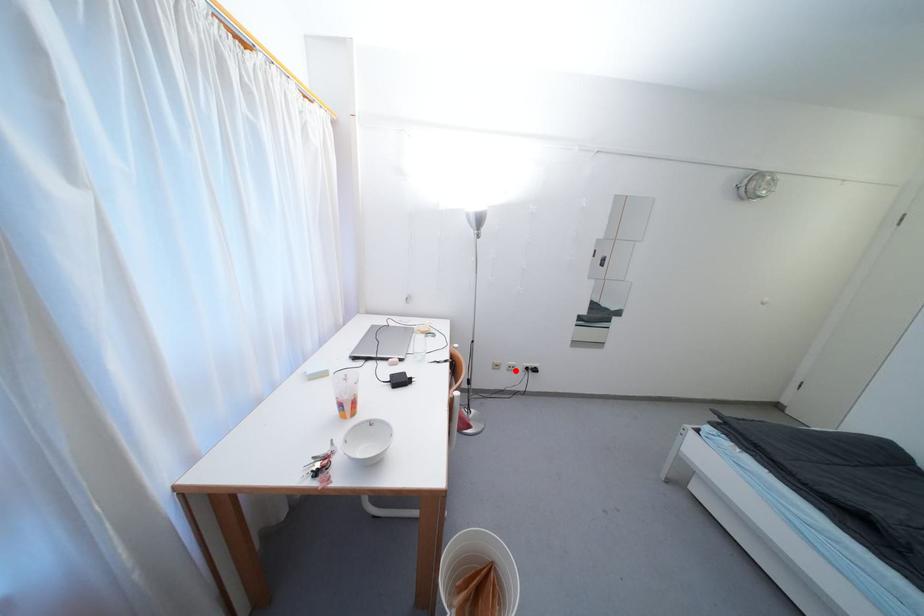
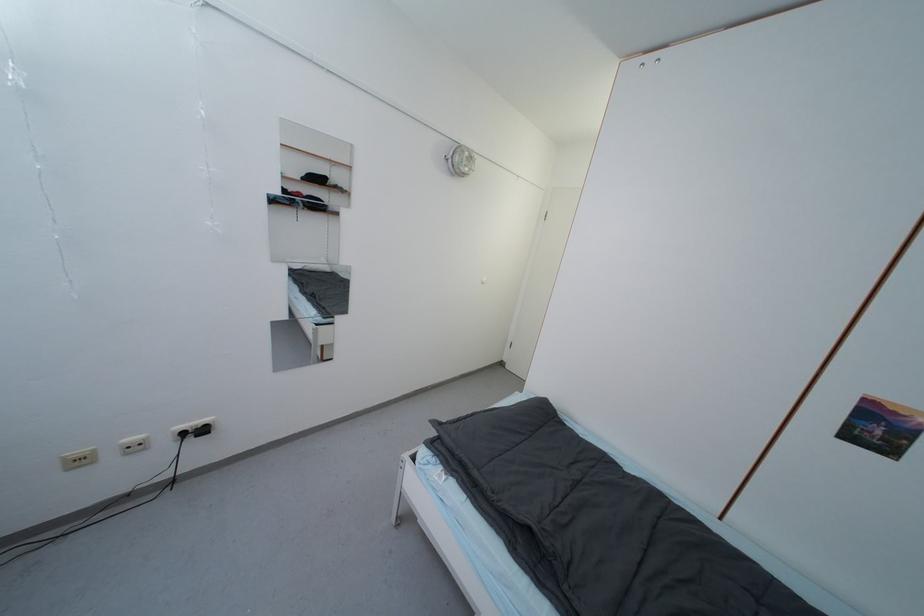
Locate, in the second image, the point that corresponds to the highlighted location in the first image.

(140, 450)